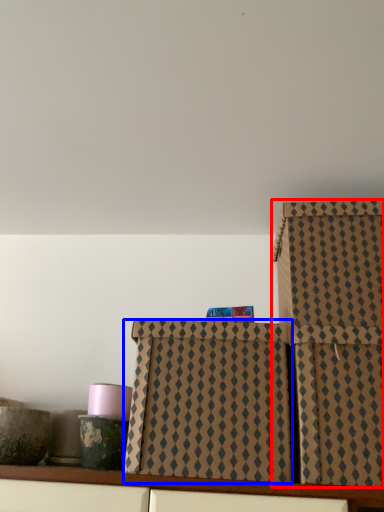
Question: Among these objects, which one is nearest to the camera, box (highlighted by a red box) or box (highlighted by a blue box)?

Choices:
 (A) box
 (B) box

Answer: (A)